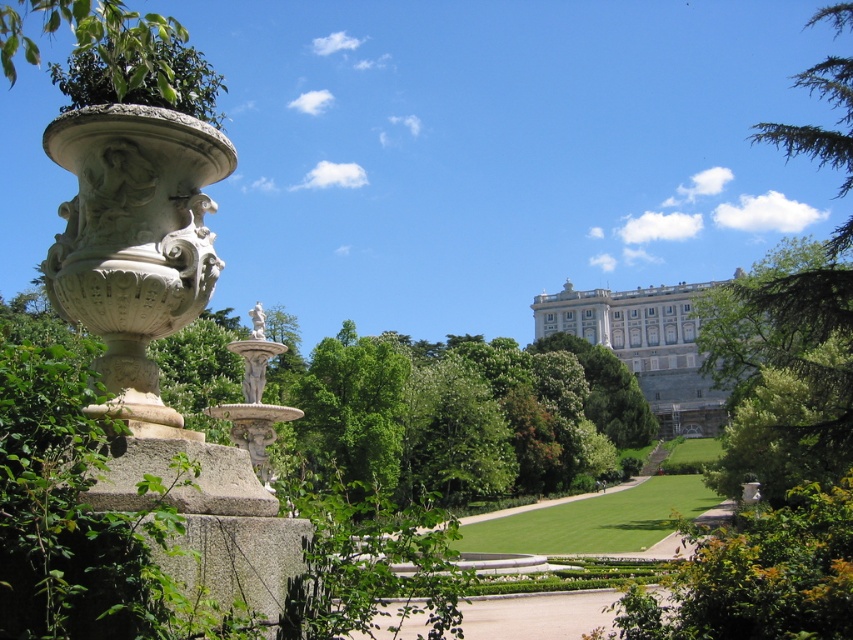
Question: Considering the real-world distances, which object is closest to the green leafy tree at upper right?

Choices:
 (A) white stone palace at upper center
 (B) white marble statue at center

Answer: (B)

Question: Which of the following is the farthest from the observer?

Choices:
 (A) green leafy tree at upper right
 (B) white marble statue at center

Answer: (A)

Question: Which point appears farthest from the camera in this image?

Choices:
 (A) (747, 362)
 (B) (662, 417)

Answer: (B)

Question: Does white stone palace at upper center appear on the left side of white marble statue at center?

Choices:
 (A) no
 (B) yes

Answer: (A)

Question: Does green leafy tree at upper right appear on the left side of white stone palace at upper center?

Choices:
 (A) no
 (B) yes

Answer: (A)

Question: Does green leafy tree at upper right appear on the right side of white stone palace at upper center?

Choices:
 (A) yes
 (B) no

Answer: (A)